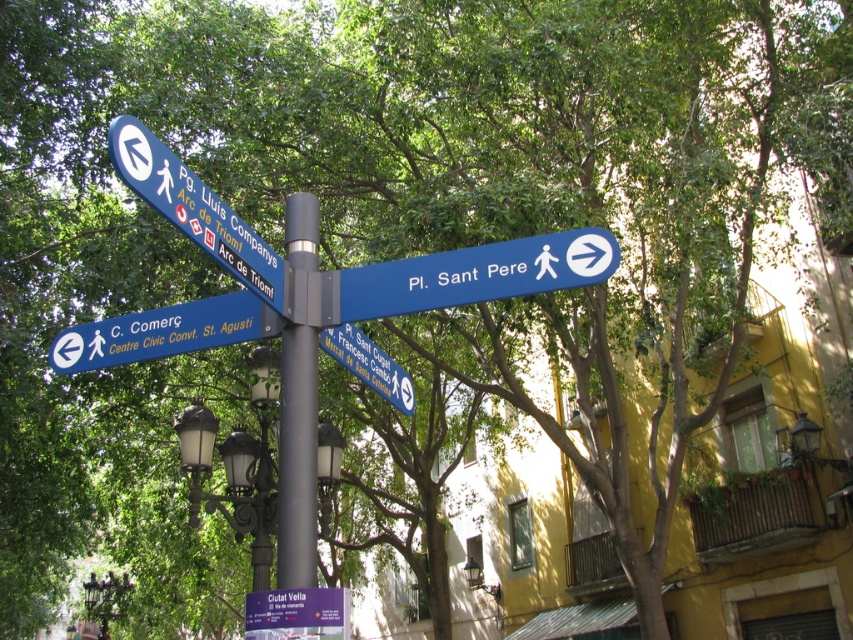
Question: Among these points, which one is farthest from the camera?

Choices:
 (A) (115, 124)
 (B) (198, 321)

Answer: (B)

Question: Which point is closer to the camera?

Choices:
 (A) (273, 609)
 (B) (372, 376)

Answer: (A)

Question: Is blue plastic sign at upper right in front of blue plastic sign at upper left?

Choices:
 (A) no
 (B) yes

Answer: (A)

Question: In this image, where is black metal streetlight at center located relative to black metal pole at center?

Choices:
 (A) left
 (B) right

Answer: (A)

Question: Which object appears closest to the camera in this image?

Choices:
 (A) purple plastic sign at center
 (B) blue plastic sign at upper right
 (C) black metal pole at center
 (D) blue plastic street sign at center

Answer: (A)

Question: Does black metal pole at center have a greater width compared to blue plastic sign at left?

Choices:
 (A) no
 (B) yes

Answer: (A)